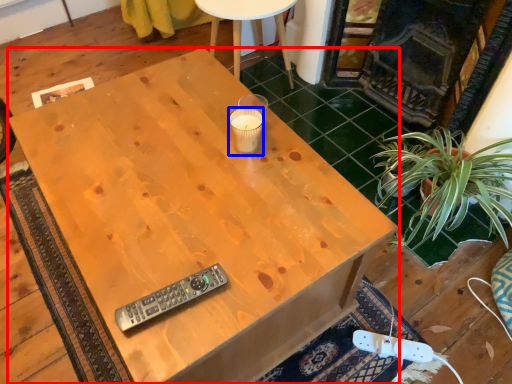
Question: Which of the following is the closest to the observer, desk (highlighted by a red box) or coffee cup (highlighted by a blue box)?

Choices:
 (A) desk
 (B) coffee cup

Answer: (A)